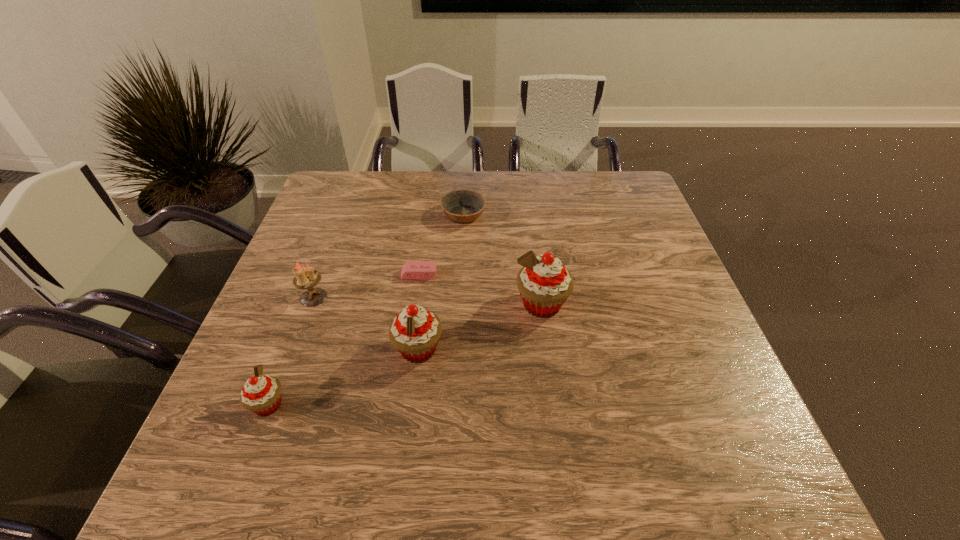
Please show where to add a cupcake on the right while keeping spacing even. Please provide its 2D coordinates. Your answer should be formatted as a tuple, i.e. [(x, y)], where the tuple contains the x and y coordinates of a point satisfying the conditions above.

[(644, 267)]